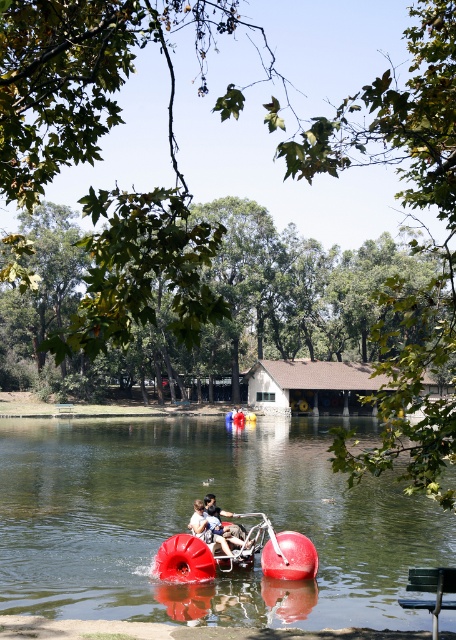
Question: Estimate the real-world distances between objects in this image. Which object is closer to the red rubber water at center?

Choices:
 (A) green plastic bench at lower right
 (B) rubberized red float at center
 (C) matte red lifebuoy at center

Answer: (B)

Question: Which of these objects is positioned closest to the green plastic bench at lower right?

Choices:
 (A) red rubber water at center
 (B) rubberized red float at center

Answer: (B)

Question: Observing the image, what is the correct spatial positioning of rubberized red float at center in reference to matte red lifebuoy at center?

Choices:
 (A) left
 (B) right

Answer: (B)

Question: Which point is farther to the camera?

Choices:
 (A) (217, 518)
 (B) (20, 438)

Answer: (B)

Question: Is red rubber water at center below rubberized red float at center?

Choices:
 (A) yes
 (B) no

Answer: (A)

Question: Is red rubber water at center bigger than matte red lifebuoy at center?

Choices:
 (A) yes
 (B) no

Answer: (A)